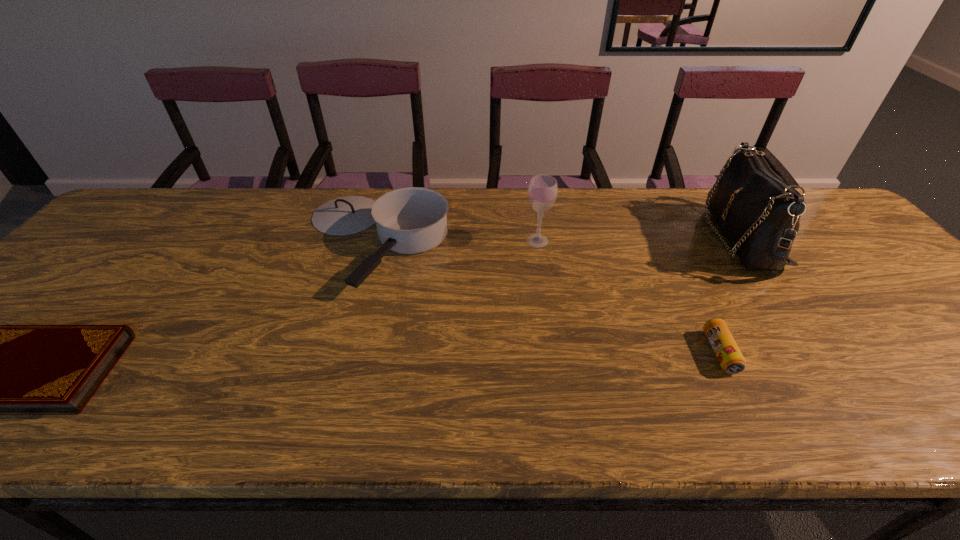
Image resolution: width=960 pixels, height=540 pixels. In order to click on free space in the image that satisfies the following two spatial constraints: 1. at the front of the handbag with chain and zipper; 2. on the front side of the saucepan in this screenshot , I will do `click(742, 241)`.